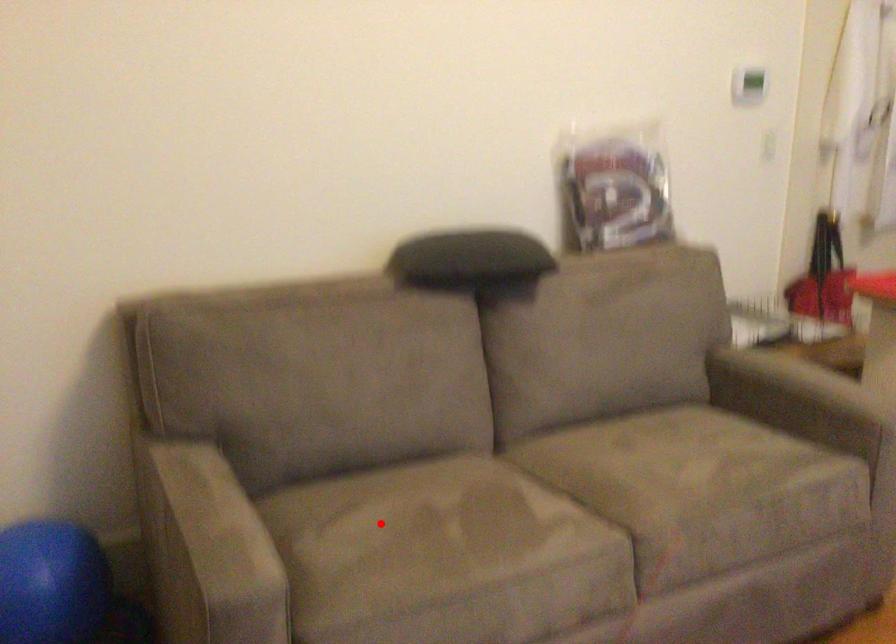
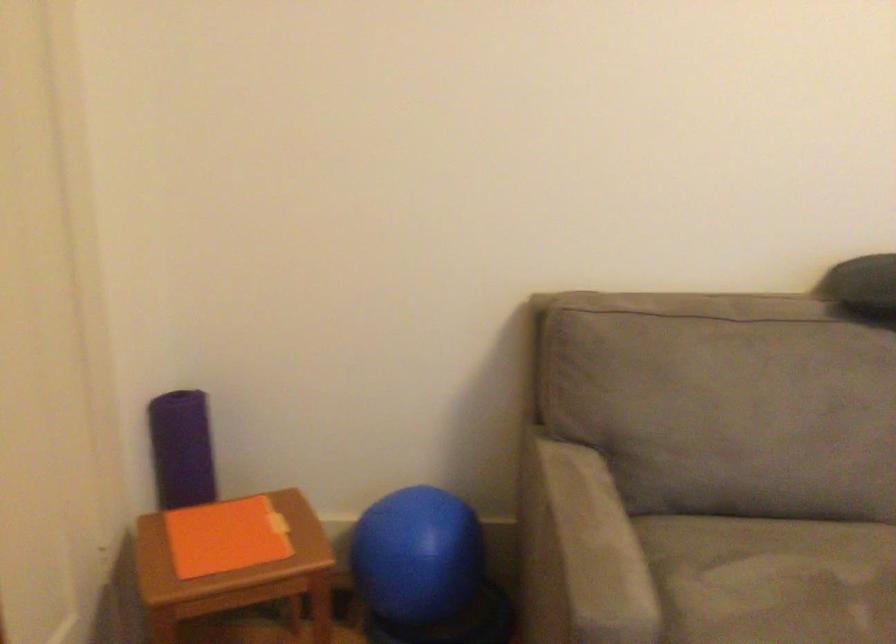
Locate, in the second image, the point that corresponds to the highlighted location in the first image.

(771, 579)